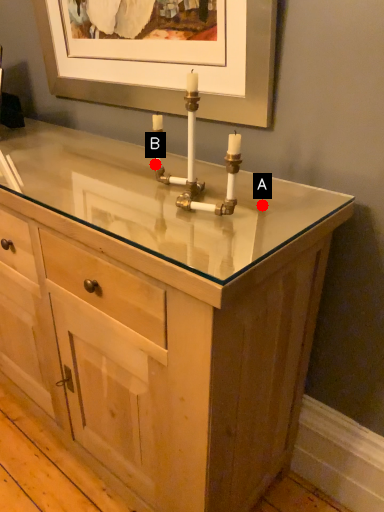
Question: Two points are circled on the image, labeled by A and B beside each circle. Which point appears closest to the camera in this image?

Choices:
 (A) A is closer
 (B) B is closer

Answer: (A)